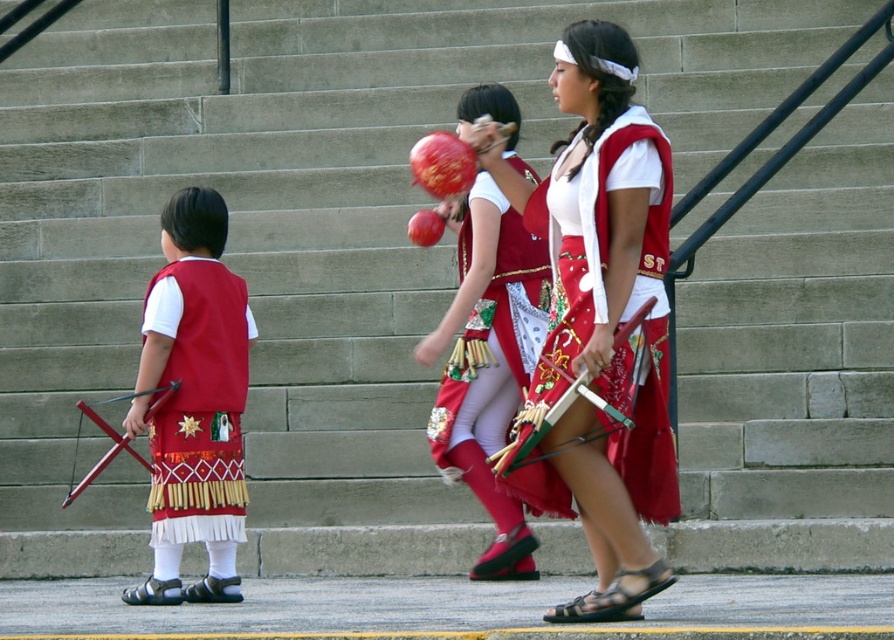
Based on the scene description, where is the matte red vest at center located in terms of its 2D coordinates?

The matte red vest at center is located at the 2D coordinates of point (599, 320).

Based on the scene description, where is the matte red vest at center located in relation to the point at coordinates (599, 320)?

The point at coordinates (599, 320) corresponds to the matte red vest at center, so they are in the same location.